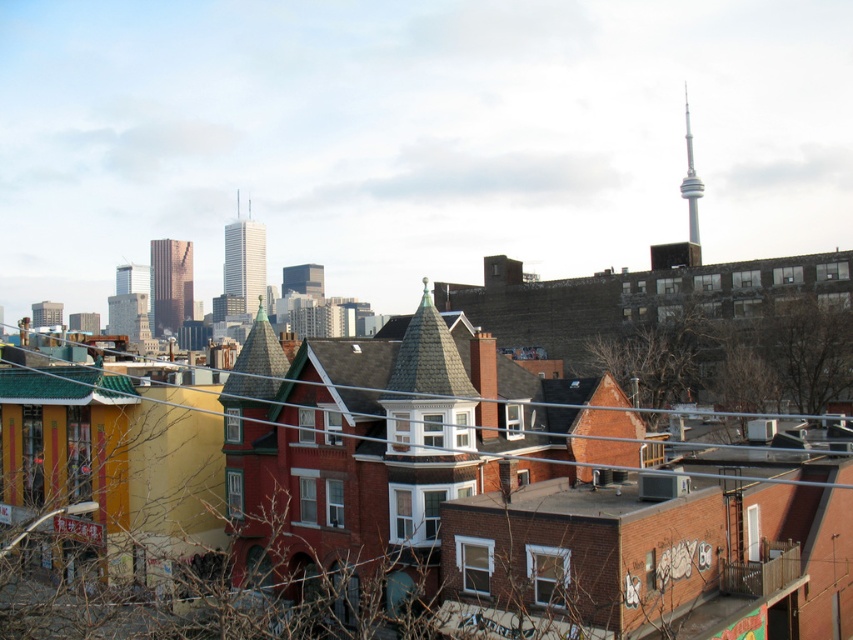
You are standing in the cityscape and want to determine which of the two points, point (41, 404) or point (190, 312), is nearer to you. Based on the scene, which point is closer?

Point (41, 404) is closer to the viewer than point (190, 312).

You are a city planner analyzing the urban layout. You need to determine if the metallic wire at lower center can be safely removed without affecting the structural integrity of the shiny glass skyscraper at center. Based on their relative heights, is this feasible?

The metallic wire at lower center is not as tall as the shiny glass skyscraper at center, so removing it would not impact the skyscraper since it is shorter and likely unrelated to its structure.

You are standing at the viewpoint of the image and want to walk from point A to point B. If point A is at point (x=247, y=256) and point B is at point (x=186, y=285), will you need to go around any obstacles between them?

Point (x=186, y=285) is behind point (x=247, y=256), so you would need to go around obstacles between them to reach point B from point A.